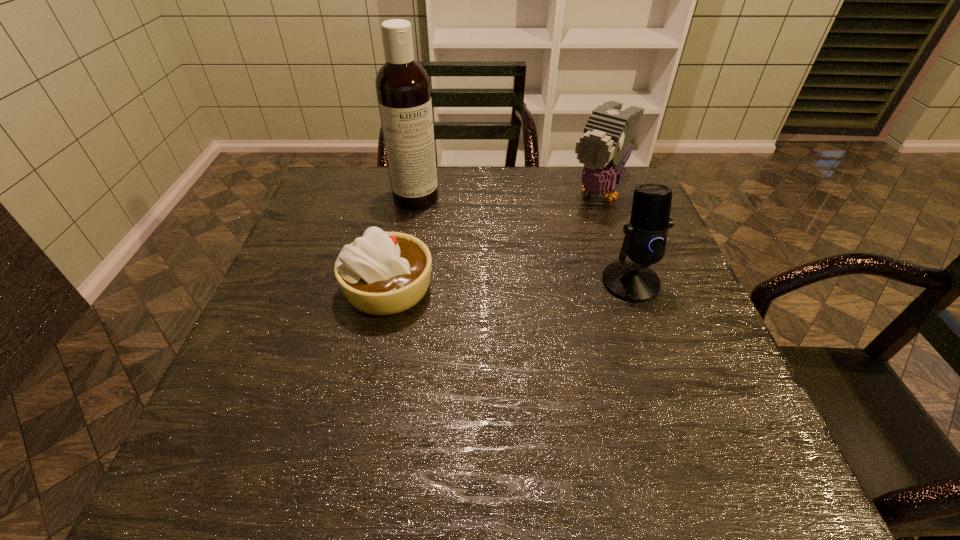
At what (x,y) coordinates should I click in order to perform the action: click on vacant spot on the desktop that is between the shortest object and the microphone and is positioned at the beak of the bird. Please return your answer as a coordinate pair (x, y). This screenshot has width=960, height=540. Looking at the image, I should click on (517, 285).

Find the location of a particular element. This screenshot has height=540, width=960. vacant spot on the desktop that is between the whipped cream and the microphone and is positioned on the label side of the dishwasher detergent is located at coordinates (486, 286).